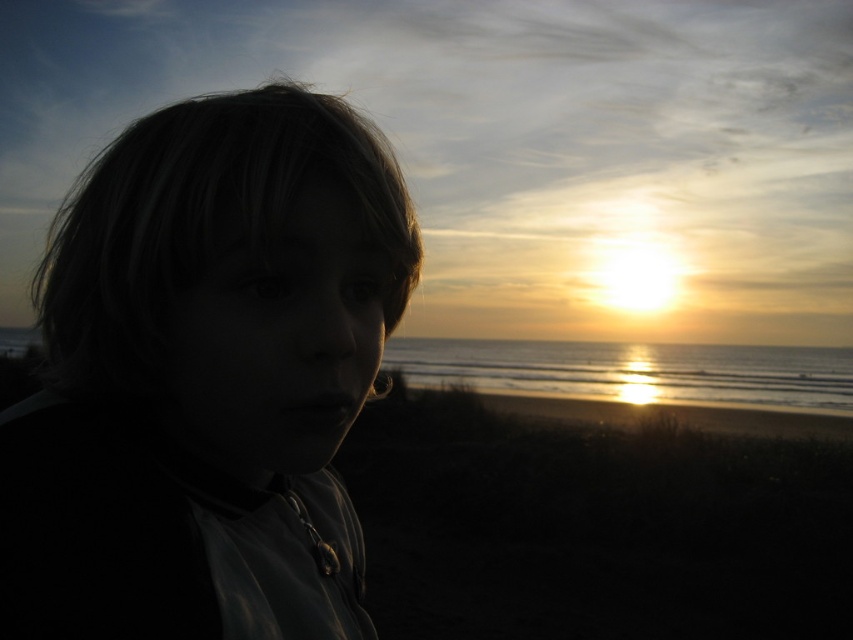
Who is higher up, matte black hair at left or glistening silver water at center?

matte black hair at left is above.

Between matte black hair at left and glistening silver water at center, which one has less height?

Standing shorter between the two is matte black hair at left.

Is point (225, 460) in front of point (469, 387)?

Yes, it is.

The height and width of the screenshot is (640, 853). I want to click on matte black hair at left, so click(x=206, y=378).